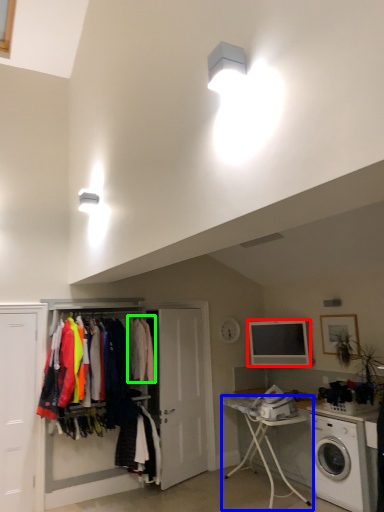
Question: Which object is the closest to the appliance (highlighted by a red box)? Choose among these: table (highlighted by a blue box) or clothing (highlighted by a green box).

Choices:
 (A) table
 (B) clothing

Answer: (A)